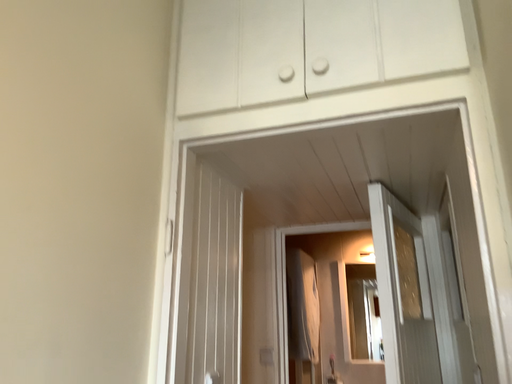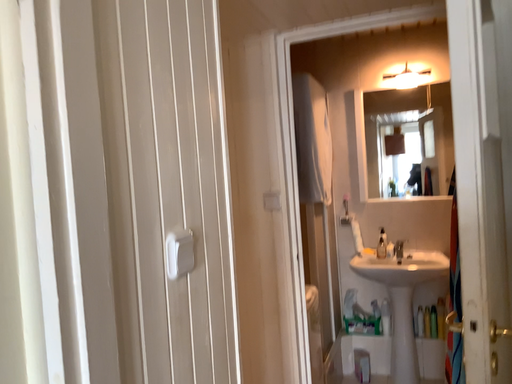
Question: Which way did the camera rotate in the video?

Choices:
 (A) rotated downward
 (B) rotated upward

Answer: (A)